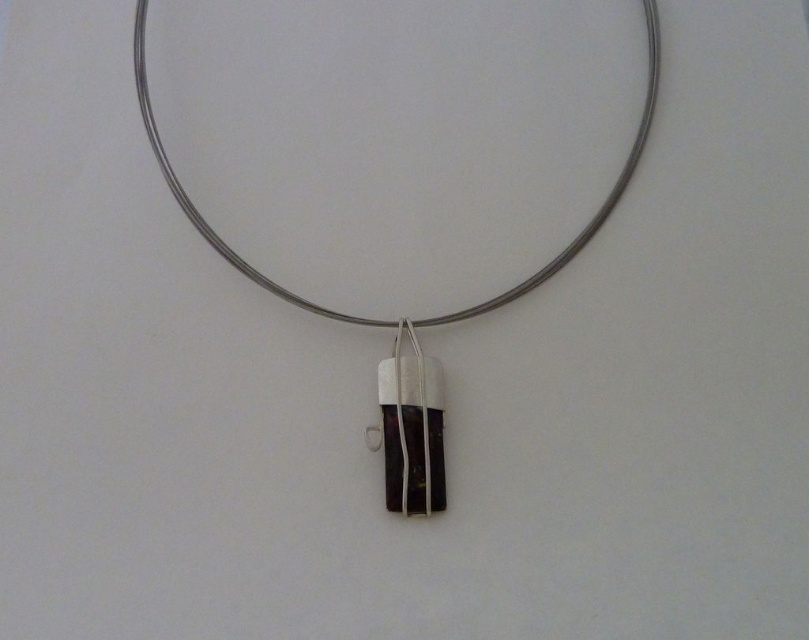
Consider the image. Can you confirm if silver wire necklace at center is bigger than matte silver pendant at center?

Indeed, silver wire necklace at center has a larger size compared to matte silver pendant at center.

Between point (204, 220) and point (405, 324), which one is positioned behind?

Positioned behind is point (405, 324).

Between point (176, 195) and point (403, 323), which one is positioned behind?

The point (403, 323) is behind.

Where is `silver wire necklace at center`? silver wire necklace at center is located at coordinates (602, 202).